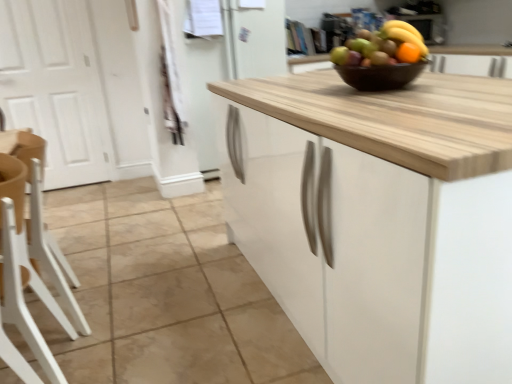
The height and width of the screenshot is (384, 512). I want to click on vacant area that is in front of white matte door at left, so click(69, 203).